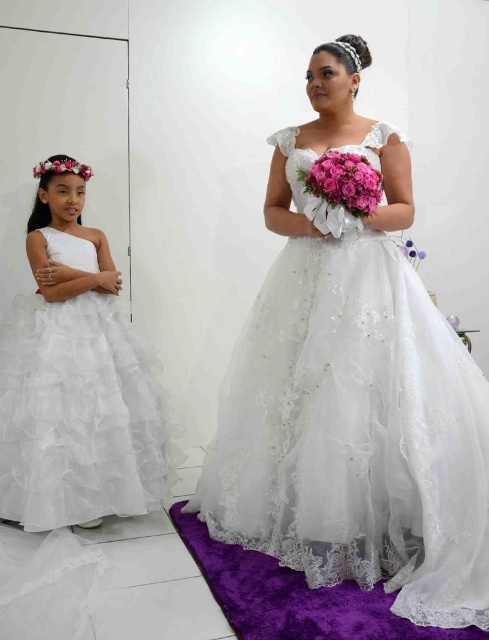
Question: Does lace/embroidered gown at center have a greater width compared to floral crown at upper left?

Choices:
 (A) yes
 (B) no

Answer: (A)

Question: Is the position of lace/embroidered gown at center more distant than that of white tulle dress at left?

Choices:
 (A) no
 (B) yes

Answer: (A)

Question: Which is farther from the purple fabric flower at upper center?

Choices:
 (A) floral crown at upper left
 (B) pink satin bouquet at center
 (C) white tulle dress at left

Answer: (C)

Question: Which object is positioned closest to the purple fabric flower at upper center?

Choices:
 (A) pink satin bouquet at center
 (B) white tulle dress at left
 (C) lace/embroidered gown at center
 (D) floral crown at upper left

Answer: (A)

Question: Which of the following is the closest to the observer?

Choices:
 (A) (282, 536)
 (B) (331, 164)
 (C) (420, 252)

Answer: (B)

Question: Where is white tulle dress at left located in relation to floral crown at upper left in the image?

Choices:
 (A) right
 (B) left

Answer: (A)